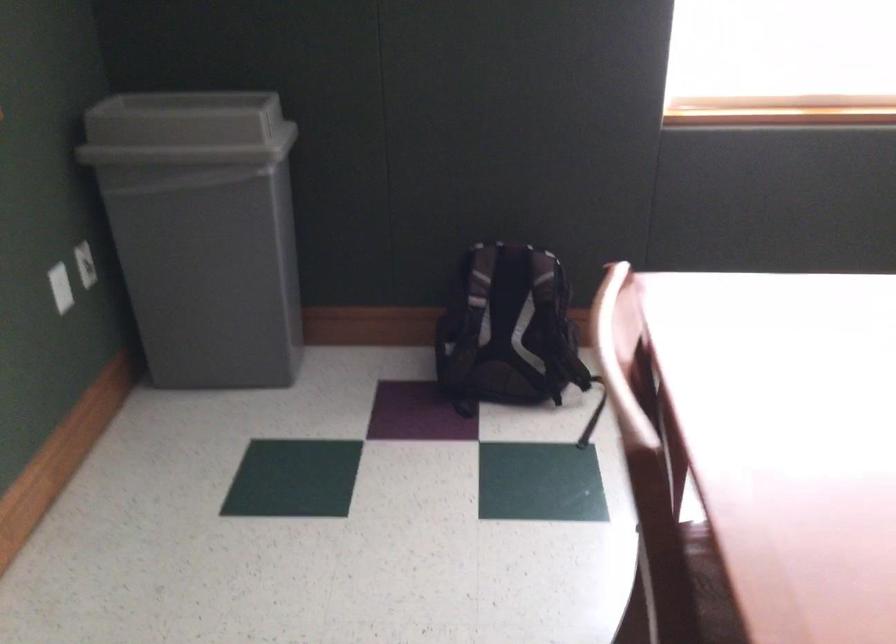
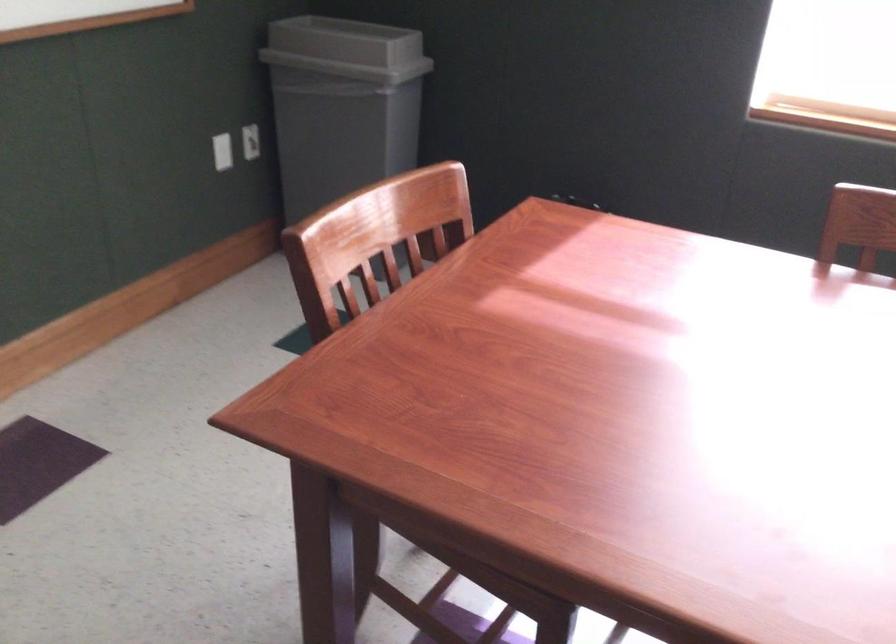
Question: What movement of the cameraman would produce the second image?

Choices:
 (A) Left
 (B) Right
 (C) Forward
 (D) Backward

Answer: (B)